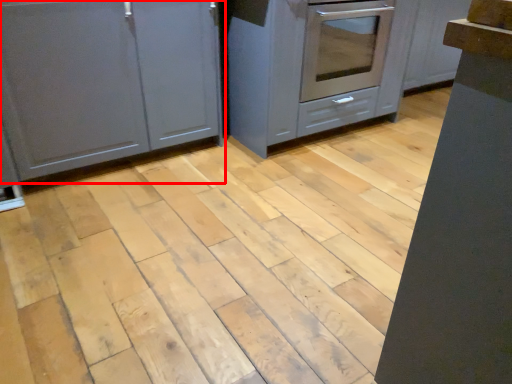
Question: Considering the relative positions of cabinetry (annotated by the red box) and cabinetry in the image provided, where is cabinetry (annotated by the red box) located with respect to the staircase?

Choices:
 (A) right
 (B) left

Answer: (B)